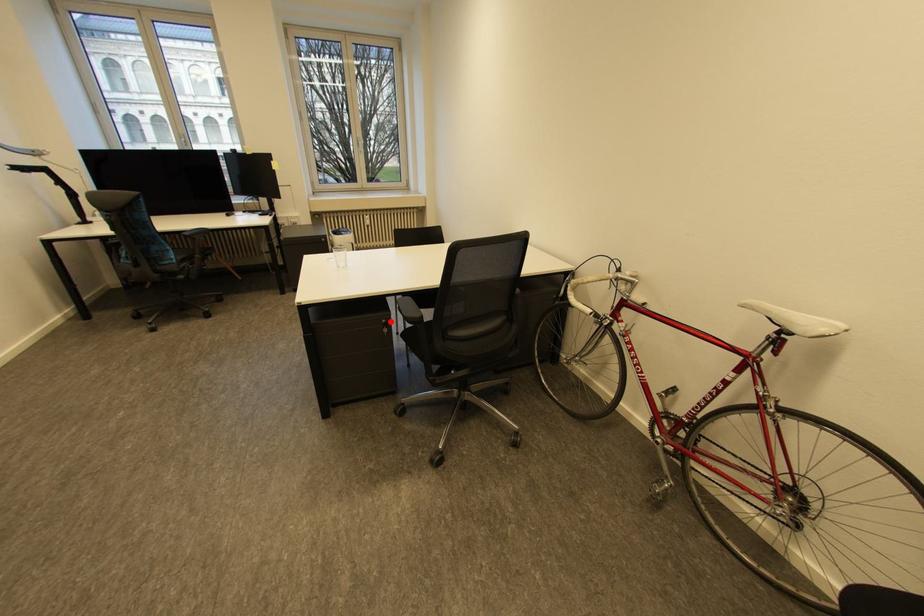
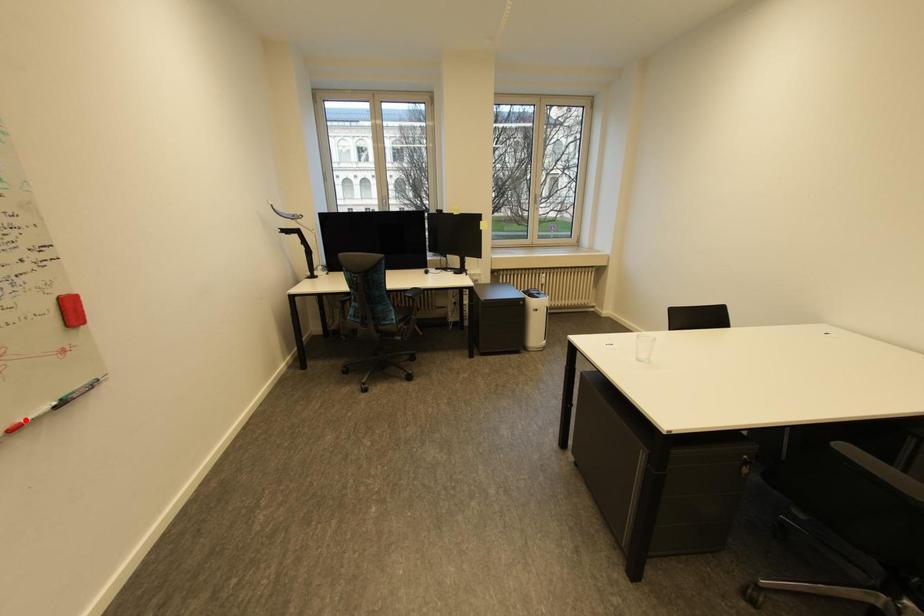
I am providing you with two images of the same scene from different viewpoints. A red point is marked on the first image and another point is marked on the second image. Does the point marked in image1 correspond to the same location as the one in image2?

No